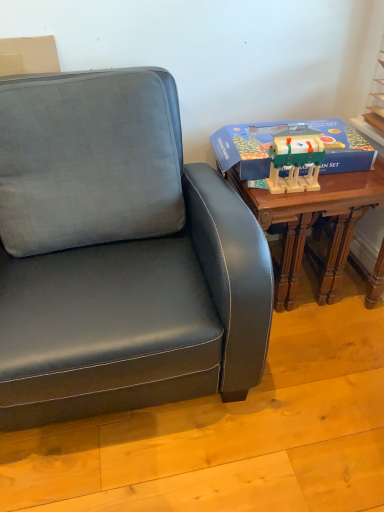
Question: Is blue cardboard box at right far away from wooden table at right?

Choices:
 (A) yes
 (B) no

Answer: (B)

Question: Would you say blue cardboard box at right contains wooden table at right?

Choices:
 (A) no
 (B) yes

Answer: (A)

Question: Is the depth of blue cardboard box at right greater than that of wooden table at right?

Choices:
 (A) yes
 (B) no

Answer: (A)

Question: Does blue cardboard box at right appear on the left side of wooden table at right?

Choices:
 (A) yes
 (B) no

Answer: (A)

Question: From the image's perspective, is blue cardboard box at right located beneath wooden table at right?

Choices:
 (A) no
 (B) yes

Answer: (A)

Question: Is blue cardboard box at right bigger than wooden table at right?

Choices:
 (A) no
 (B) yes

Answer: (A)

Question: Is wooden christmas train set at right not near blue cardboard box at right?

Choices:
 (A) no
 (B) yes

Answer: (A)

Question: Can you confirm if wooden christmas train set at right is thinner than blue cardboard box at right?

Choices:
 (A) yes
 (B) no

Answer: (A)

Question: Can you confirm if wooden christmas train set at right is taller than blue cardboard box at right?

Choices:
 (A) no
 (B) yes

Answer: (B)

Question: Is wooden christmas train set at right to the right of blue cardboard box at right from the viewer's perspective?

Choices:
 (A) yes
 (B) no

Answer: (B)

Question: Is wooden christmas train set at right touching blue cardboard box at right?

Choices:
 (A) no
 (B) yes

Answer: (A)

Question: Does wooden christmas train set at right appear on the left side of blue cardboard box at right?

Choices:
 (A) no
 (B) yes

Answer: (B)

Question: Is wooden christmas train set at right further to camera compared to wooden table at right?

Choices:
 (A) no
 (B) yes

Answer: (A)